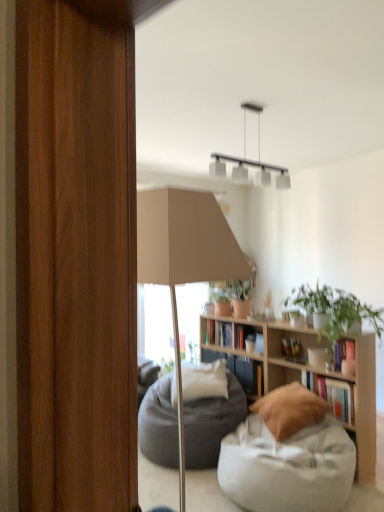
In order to face wooden bookshelf at center, should I rotate leftwards or rightwards?

Turn right approximately 11.113 degrees to face it.

Locate an element on the screen. The image size is (384, 512). dark gray fabric bean bag at center is located at coordinates (211, 424).

Describe the element at coordinates (211, 424) in the screenshot. The image size is (384, 512). I see `dark gray fabric bean bag at center` at that location.

The width and height of the screenshot is (384, 512). What do you see at coordinates (250, 160) in the screenshot?
I see `white matte pendant light at upper center` at bounding box center [250, 160].

Where is `green matte plant at upper right`? green matte plant at upper right is located at coordinates (336, 314).

Which of these two, white soft pillow at center, which appears as the second pillow when viewed from the right, or dark gray fabric bean bag at center, is bigger?

dark gray fabric bean bag at center is bigger.

Where is `bean bag chair in front of the white soft pillow at center, positioned as the first pillow in back-to-front order`? bean bag chair in front of the white soft pillow at center, positioned as the first pillow in back-to-front order is located at coordinates (211, 424).

Measure the distance between white soft pillow at center, which is counted as the first pillow, starting from the left, and dark gray fabric bean bag at center.

The distance of white soft pillow at center, which is counted as the first pillow, starting from the left, from dark gray fabric bean bag at center is 22.25 centimeters.

Is white soft pillow at center, which is counted as the first pillow, starting from the left, taller than dark gray fabric bean bag at center?

Incorrect, the height of white soft pillow at center, which is counted as the first pillow, starting from the left, is not larger of that of dark gray fabric bean bag at center.

Does hardcover book at center, the second book when ordered from right to left, have a larger size compared to white soft pillow at center, which is counted as the first pillow, starting from the left?

No, hardcover book at center, the second book when ordered from right to left, is not bigger than white soft pillow at center, which is counted as the first pillow, starting from the left.

In terms of width, does hardcover book at center, which ranks as the 2th book in front-to-back order, look wider or thinner when compared to white soft pillow at center, which appears as the second pillow when viewed from the right?

hardcover book at center, which ranks as the 2th book in front-to-back order, is thinner than white soft pillow at center, which appears as the second pillow when viewed from the right.

Can white soft pillow at center, positioned as the first pillow in back-to-front order, be found inside hardcover book at center, which ranks as the second book in left-to-right order?

Actually, white soft pillow at center, positioned as the first pillow in back-to-front order, is outside hardcover book at center, which ranks as the second book in left-to-right order.

Which is more to the left, hardcover book at center, which ranks as the second book in left-to-right order, or white soft pillow at center, which is counted as the first pillow, starting from the left?

From the viewer's perspective, white soft pillow at center, which is counted as the first pillow, starting from the left, appears more on the left side.

Is hardcover book at center, which is the 1th book in right-to-left order, looking in the opposite direction of white soft pillow at center, positioned as the first pillow in back-to-front order?

No, hardcover book at center, which is the 1th book in right-to-left order,'s orientation is not away from white soft pillow at center, positioned as the first pillow in back-to-front order.

Between point (334, 387) and point (202, 365), which one is positioned in front?

The point (334, 387) is more forward.

How distant is hardcover book at center, the 3th book viewed from the back, from white soft pillow at center, placed as the second pillow when sorted from front to back?

A distance of 32.22 inches exists between hardcover book at center, the 3th book viewed from the back, and white soft pillow at center, placed as the second pillow when sorted from front to back.

Can you see hardcover book at center, the 3th book viewed from the back, touching white soft pillow at center, positioned as the first pillow in back-to-front order?

No, hardcover book at center, the 3th book viewed from the back, is not beside white soft pillow at center, positioned as the first pillow in back-to-front order.

Is dark gray fabric bean bag at center facing towards green matte plant at upper right?

No, dark gray fabric bean bag at center is not turned towards green matte plant at upper right.

Is dark gray fabric bean bag at center situated inside green matte plant at upper right or outside?

dark gray fabric bean bag at center lies outside green matte plant at upper right.

Would you consider dark gray fabric bean bag at center to be distant from green matte plant at upper right?

Absolutely, dark gray fabric bean bag at center is distant from green matte plant at upper right.

At what (x,y) coordinates should I click in order to perform the action: click on houseplant above the dark gray fabric bean bag at center (from a real-world perspective). Please return your answer as a coordinate pair (x, y). Looking at the image, I should click on (336, 314).

Considering the relative positions of white matte pendant light at upper center and white fabric bean bag at lower right in the image provided, is white matte pendant light at upper center to the left or to the right of white fabric bean bag at lower right?

white matte pendant light at upper center is to the left of white fabric bean bag at lower right.

Between white matte pendant light at upper center and white fabric bean bag at lower right, which one is positioned in front?

white fabric bean bag at lower right is more forward.

The width and height of the screenshot is (384, 512). I want to click on chair in front of the white matte pendant light at upper center, so click(288, 456).

Is white matte pendant light at upper center not near white fabric bean bag at lower right?

white matte pendant light at upper center is far away from white fabric bean bag at lower right.

In terms of size, does hardcover book at center, the 3th book viewed from the back, appear bigger or smaller than hardcover book at center, acting as the first book starting from the back?

hardcover book at center, the 3th book viewed from the back, is bigger than hardcover book at center, acting as the first book starting from the back.

In the scene shown: Would you consider hardcover book at center, which is counted as the third book, starting from the left, to be distant from hardcover book at center, acting as the first book starting from the back?

No, hardcover book at center, which is counted as the third book, starting from the left, is not far from hardcover book at center, acting as the first book starting from the back.

Would you say hardcover book at center, the 3th book viewed from the back, is to the left or to the right of hardcover book at center, acting as the first book starting from the back, in the picture?

In the image, hardcover book at center, the 3th book viewed from the back, appears on the right side of hardcover book at center, acting as the first book starting from the back.

Can you tell me how much hardcover book at center, which is the 1th book in right-to-left order, and hardcover book at center, the 3th book from the right, differ in facing direction?

hardcover book at center, which is the 1th book in right-to-left order, and hardcover book at center, the 3th book from the right, are facing 0.102 degrees away from each other.

Is white matte pendant light at upper center in front of or behind green matte plant at upper right in the image?

white matte pendant light at upper center is in front of green matte plant at upper right.

Which of these two, white matte pendant light at upper center or green matte plant at upper right, is smaller?

white matte pendant light at upper center is smaller.

Between white matte pendant light at upper center and green matte plant at upper right, which one has more height?

white matte pendant light at upper center is taller.

Identify the location of bean bag chair below the white soft pillow at center, which is counted as the first pillow, starting from the left (from the image's perspective). (211, 424).

I want to click on pillow above the hardcover book at center, which ranks as the second book in left-to-right order (from a real-world perspective), so click(200, 381).

Estimate the real-world distances between objects in this image. Which object is closer to white fabric bean bag at lower right, green matte plant at upper right or brown suede pillow at lower center, which is counted as the first pillow, starting from the front?

brown suede pillow at lower center, which is counted as the first pillow, starting from the front, lies closer to white fabric bean bag at lower right than the other object.

In the scene shown: From the image, which object appears to be nearer to dark gray fabric bean bag at center, hardcover book at center, which appears as the first book when viewed from the left, or hardcover book at center, which is counted as the third book, starting from the left?

Among the two, hardcover book at center, which appears as the first book when viewed from the left, is located nearer to dark gray fabric bean bag at center.

When comparing their distances from hardcover book at center, the first book in the front-to-back sequence, does hardcover book at center, which ranks as the 2th book in front-to-back order, or green matte plant at upper right seem further?

hardcover book at center, which ranks as the 2th book in front-to-back order.

From the picture: From the image, which object appears to be farther from dark gray fabric bean bag at center, brown suede pillow at lower center, acting as the second pillow starting from the back, or wooden bookshelf at center?

wooden bookshelf at center.

From the picture: From the image, which object appears to be nearer to wooden bookshelf at center, white soft pillow at center, which is counted as the first pillow, starting from the left, or white fabric bean bag at lower right?

white fabric bean bag at lower right.

From the image, which object appears to be farther from wooden bookshelf at center, hardcover book at center, which ranks as the second book in left-to-right order, or white soft pillow at center, which is counted as the first pillow, starting from the left?

white soft pillow at center, which is counted as the first pillow, starting from the left, is positioned further to the anchor wooden bookshelf at center.

Based on their spatial positions, is white soft pillow at center, which is counted as the first pillow, starting from the left, or white fabric bean bag at lower right further from white matte pendant light at upper center?

Among the two, white fabric bean bag at lower right is located further to white matte pendant light at upper center.

Looking at the image, which one is located further to white soft pillow at center, which is counted as the first pillow, starting from the left, green matte plant at upper right or hardcover book at center, which appears as the first book when viewed from the left?

green matte plant at upper right.

Image resolution: width=384 pixels, height=512 pixels. What are the coordinates of `bean bag chair between green matte plant at upper right and hardcover book at center, the 3th book from the right, in the front-back direction` in the screenshot? It's located at 211,424.

What are the coordinates of `book between brown suede pillow at lower center, which is counted as the first pillow, starting from the front, and hardcover book at center, the second book when ordered from right to left, in the front-back direction` in the screenshot? It's located at (332, 394).

I want to click on chair between dark gray fabric bean bag at center and brown suede pillow at lower center, acting as the first pillow starting from the right, so click(x=288, y=456).

In order to click on bookcase between dark gray fabric bean bag at center and green matte plant at upper right in this screenshot , I will do `click(308, 376)`.